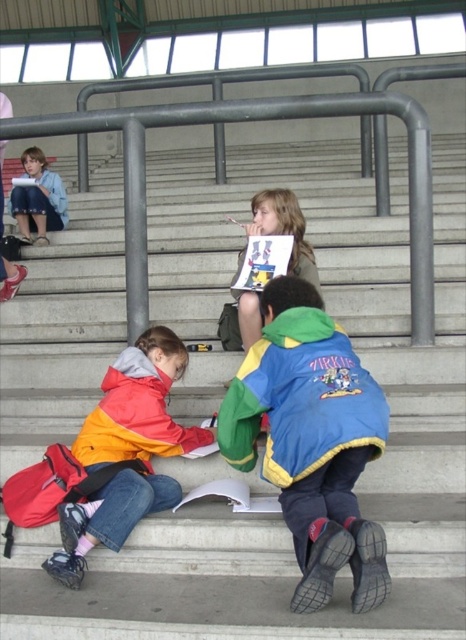
You are standing at the entrance of the stadium and want to locate the matte yellow jacket at center. According to the coordinates provided, where should you look to find it?

The matte yellow jacket at center is located at coordinates point (283, 228).

You are a photographer standing at the bottom of the steps. You want to take a picture of the orange fleece jacket at lower left and the matte yellow jacket at center. Can you fit both jackets in the frame without moving your position? Explain why or why not.

The orange fleece jacket at lower left is 35.06 inches away from the matte yellow jacket at center. Since the distance between them is 35.06 inches, it depends on your camera lens and framing. If your camera has a wide enough angle or zoom level to capture both jackets within the same frame from your current position, then yes. Otherwise, you might need to adjust your equipment.